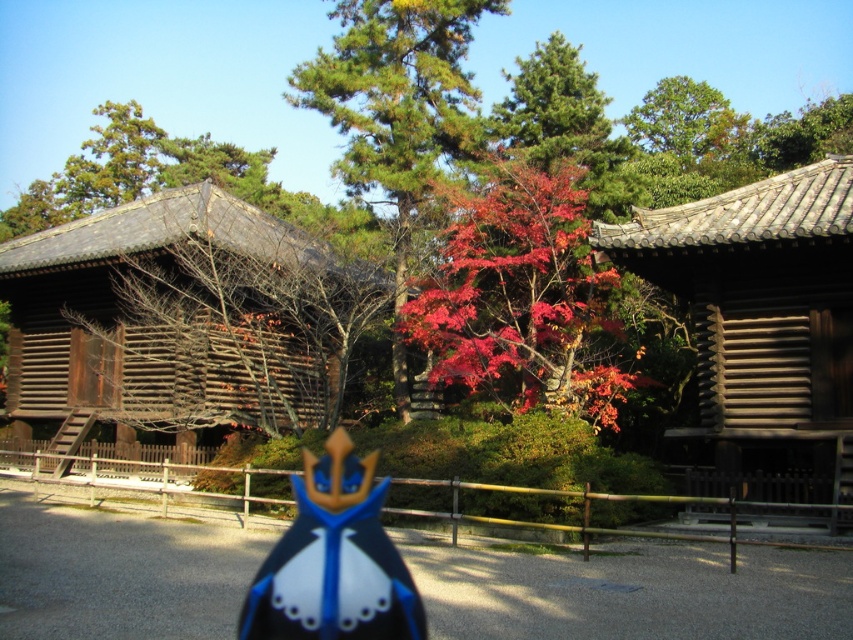
You are planning to place a new decorative item between the wooden shingles hut at right and the blue glossy crown at center. Based on their widths, which object should you place closer to the narrower side to maintain balance?

The wooden shingles hut at right has a smaller width compared to the blue glossy crown at center. To maintain balance, place the new decorative item closer to the wooden shingles hut at right since it is narrower.